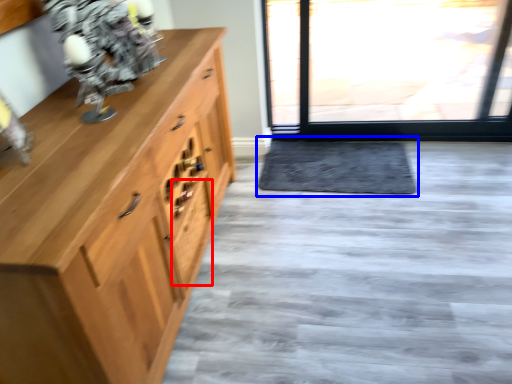
Question: Which object appears closest to the camera in this image, drawer (highlighted by a red box) or doormat (highlighted by a blue box)?

Choices:
 (A) drawer
 (B) doormat

Answer: (A)